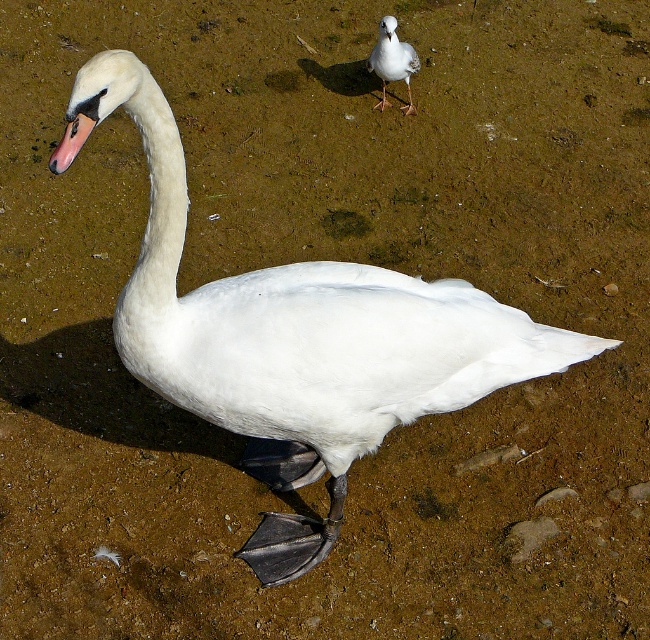
Question: Is white feathered bird at upper center thinner than pink matte beak at center-left?

Choices:
 (A) yes
 (B) no

Answer: (B)

Question: Which of the following is the farthest from the observer?

Choices:
 (A) pink matte beak at center-left
 (B) white feathered bird at upper center

Answer: (B)

Question: Does white feathered bird at upper center come in front of pink matte beak at center-left?

Choices:
 (A) no
 (B) yes

Answer: (A)

Question: Which point is closer to the camera?

Choices:
 (A) pink matte beak at center-left
 (B) white feathered bird at upper center

Answer: (A)

Question: Can you confirm if white feathered bird at upper center is positioned to the left of pink matte beak at center-left?

Choices:
 (A) yes
 (B) no

Answer: (B)

Question: Which point is closer to the camera?

Choices:
 (A) (391, 26)
 (B) (57, 160)

Answer: (B)